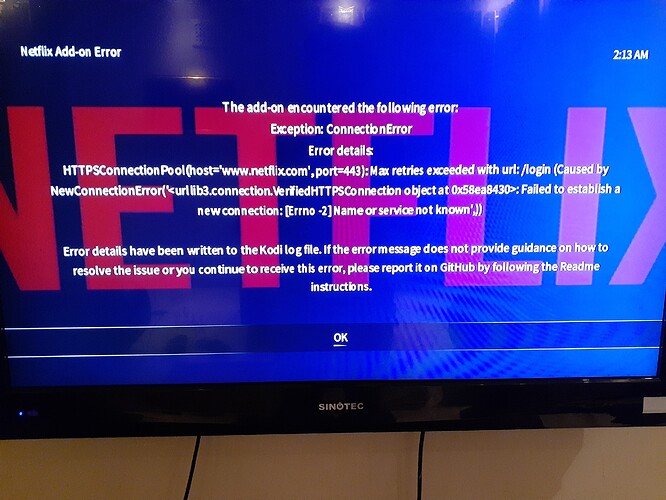
Identify the location of black frame. (467, 410), (661, 363), (2, 375).